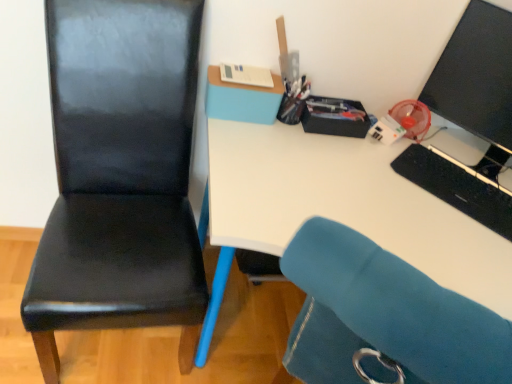
The image size is (512, 384). What are the coordinates of `vacant space underneath black matte keyboard at right (from a real-world perspective)` in the screenshot? It's located at [x=463, y=192].